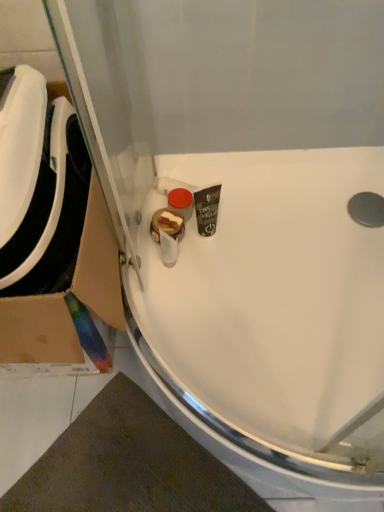
Where is `cardboard at left`? The image size is (384, 512). cardboard at left is located at coordinates (37, 331).

Is cardboard at left a part of white glossy sink at left, which ranks as the 2th sink in right-to-left order?

That's incorrect, cardboard at left is not inside white glossy sink at left, which ranks as the 2th sink in right-to-left order.

Is white glossy sink at left, arranged as the 1th sink when viewed from the left, facing away from cardboard at left?

Yes, white glossy sink at left, arranged as the 1th sink when viewed from the left,'s orientation is away from cardboard at left.

Considering the points (33, 255) and (16, 359), which point is in front, point (33, 255) or point (16, 359)?

The point (33, 255) is closer to the camera.

Between cardboard at left and white glossy sink at center, marked as the 2th sink in a left-to-right arrangement, which one has larger size?

Bigger between the two is cardboard at left.

How far apart are cardboard at left and white glossy sink at center, acting as the first sink starting from the right?

cardboard at left and white glossy sink at center, acting as the first sink starting from the right, are 12.89 inches apart from each other.

What's the angular difference between cardboard at left and white glossy sink at center, acting as the first sink starting from the right,'s facing directions?

The angle between the facing direction of cardboard at left and the facing direction of white glossy sink at center, acting as the first sink starting from the right, is 1.03 degrees.

Is cardboard at left completely or partially outside of white glossy sink at center, acting as the first sink starting from the right?

cardboard at left lies outside white glossy sink at center, acting as the first sink starting from the right,'s area.

Is white glossy sink at center, marked as the 2th sink in a left-to-right arrangement, not near white glossy sink at left, which ranks as the 2th sink in right-to-left order?

Actually, white glossy sink at center, marked as the 2th sink in a left-to-right arrangement, and white glossy sink at left, which ranks as the 2th sink in right-to-left order, are a little close together.

In the scene shown: From a real-world perspective, is white glossy sink at center, acting as the first sink starting from the right, positioned over white glossy sink at left, which ranks as the 2th sink in right-to-left order, based on gravity?

No, from a real-world perspective, white glossy sink at center, acting as the first sink starting from the right, is not over white glossy sink at left, which ranks as the 2th sink in right-to-left order

Considering the relative sizes of white glossy sink at center, acting as the first sink starting from the right, and white glossy sink at left, which ranks as the 2th sink in right-to-left order, in the image provided, is white glossy sink at center, acting as the first sink starting from the right, smaller than white glossy sink at left, which ranks as the 2th sink in right-to-left order,?

No.

Is the position of white glossy sink at center, acting as the first sink starting from the right, more distant than that of white glossy sink at left, arranged as the 1th sink when viewed from the left?

Yes, it is behind white glossy sink at left, arranged as the 1th sink when viewed from the left.

Considering the relative sizes of cardboard at left and white glossy sink at left, which ranks as the 2th sink in right-to-left order, in the image provided, is cardboard at left taller than white glossy sink at left, which ranks as the 2th sink in right-to-left order,?

Yes.

Which of these two, cardboard at left or white glossy sink at left, which ranks as the 2th sink in right-to-left order, is smaller?

Smaller between the two is white glossy sink at left, which ranks as the 2th sink in right-to-left order.

Are cardboard at left and white glossy sink at left, arranged as the 1th sink when viewed from the left, making contact?

They are not placed beside each other.

The height and width of the screenshot is (512, 384). Identify the location of cardboard box that is below the white glossy sink at left, arranged as the 1th sink when viewed from the left (from the image's perspective). (37, 331).

Which of these two, white glossy sink at center, acting as the first sink starting from the right, or cardboard at left, is wider?

white glossy sink at center, acting as the first sink starting from the right, is wider.

I want to click on sink on the right of cardboard at left, so click(x=271, y=320).

How far apart are white glossy sink at center, marked as the 2th sink in a left-to-right arrangement, and cardboard at left?

They are 12.89 inches apart.

Find the location of a particular element. Image resolution: width=384 pixels, height=512 pixels. sink beneath the white glossy sink at left, which ranks as the 2th sink in right-to-left order (from a real-world perspective) is located at coordinates (271, 320).

Who is bigger, white glossy sink at left, arranged as the 1th sink when viewed from the left, or white glossy sink at center, acting as the first sink starting from the right?

white glossy sink at center, acting as the first sink starting from the right.

Locate an element on the screen. The image size is (384, 512). cardboard box behind the white glossy sink at left, arranged as the 1th sink when viewed from the left is located at coordinates (37, 331).

The width and height of the screenshot is (384, 512). I want to click on sink on the right of cardboard at left, so click(271, 320).

From the image, which object appears to be farther from white glossy sink at center, acting as the first sink starting from the right, cardboard at left or white glossy sink at left, arranged as the 1th sink when viewed from the left?

Based on the image, white glossy sink at left, arranged as the 1th sink when viewed from the left, appears to be further to white glossy sink at center, acting as the first sink starting from the right.

Looking at the image, which one is located further to white glossy sink at left, arranged as the 1th sink when viewed from the left, cardboard at left or white glossy sink at center, marked as the 2th sink in a left-to-right arrangement?

white glossy sink at center, marked as the 2th sink in a left-to-right arrangement, lies further to white glossy sink at left, arranged as the 1th sink when viewed from the left, than the other object.

Looking at this image, when comparing their distances from white glossy sink at center, marked as the 2th sink in a left-to-right arrangement, does white glossy sink at left, which ranks as the 2th sink in right-to-left order, or cardboard at left seem closer?

Based on the image, cardboard at left appears to be nearer to white glossy sink at center, marked as the 2th sink in a left-to-right arrangement.

When comparing their distances from cardboard at left, does white glossy sink at center, acting as the first sink starting from the right, or white glossy sink at left, arranged as the 1th sink when viewed from the left, seem closer?

white glossy sink at left, arranged as the 1th sink when viewed from the left, is positioned closer to the anchor cardboard at left.

Looking at the image, which one is located further to cardboard at left, white glossy sink at left, which ranks as the 2th sink in right-to-left order, or white glossy sink at center, marked as the 2th sink in a left-to-right arrangement?

white glossy sink at center, marked as the 2th sink in a left-to-right arrangement, is positioned further to the anchor cardboard at left.

Based on their spatial positions, is white glossy sink at center, acting as the first sink starting from the right, or cardboard at left further from white glossy sink at left, arranged as the 1th sink when viewed from the left?

The object further to white glossy sink at left, arranged as the 1th sink when viewed from the left, is white glossy sink at center, acting as the first sink starting from the right.

The height and width of the screenshot is (512, 384). What are the coordinates of `cardboard box situated between white glossy sink at left, arranged as the 1th sink when viewed from the left, and white glossy sink at center, acting as the first sink starting from the right, from left to right` in the screenshot? It's located at (x=37, y=331).